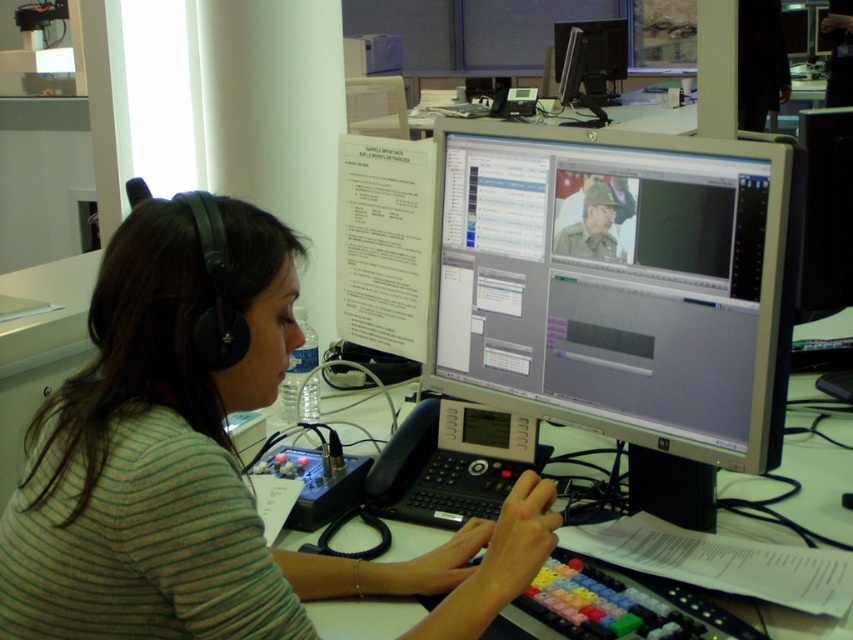
Can you confirm if white plastic table at center is positioned to the right of matte black monitor at upper center?

Incorrect, white plastic table at center is not on the right side of matte black monitor at upper center.

Can you confirm if white plastic table at center is smaller than matte black monitor at upper center?

Correct, white plastic table at center occupies less space than matte black monitor at upper center.

Where is `white plastic table at center`? The height and width of the screenshot is (640, 853). white plastic table at center is located at coordinates (817, 484).

Identify the location of white plastic table at center. (817, 484).

Does matte gray monitor at center lie in front of white plastic table at center?

No.

Can you confirm if matte gray monitor at center is shorter than white plastic table at center?

No.

Where is `matte gray monitor at center`? This screenshot has height=640, width=853. matte gray monitor at center is located at coordinates (618, 284).

Is green striped shirt at center positioned before white plastic table at center?

Yes, green striped shirt at center is closer to the viewer.

Is point (221, 509) positioned in front of point (846, 513)?

Yes, it is.

At what (x,y) coordinates should I click in order to perform the action: click on green striped shirt at center. Please return your answer as a coordinate pair (x, y). Image resolution: width=853 pixels, height=640 pixels. Looking at the image, I should click on (204, 465).